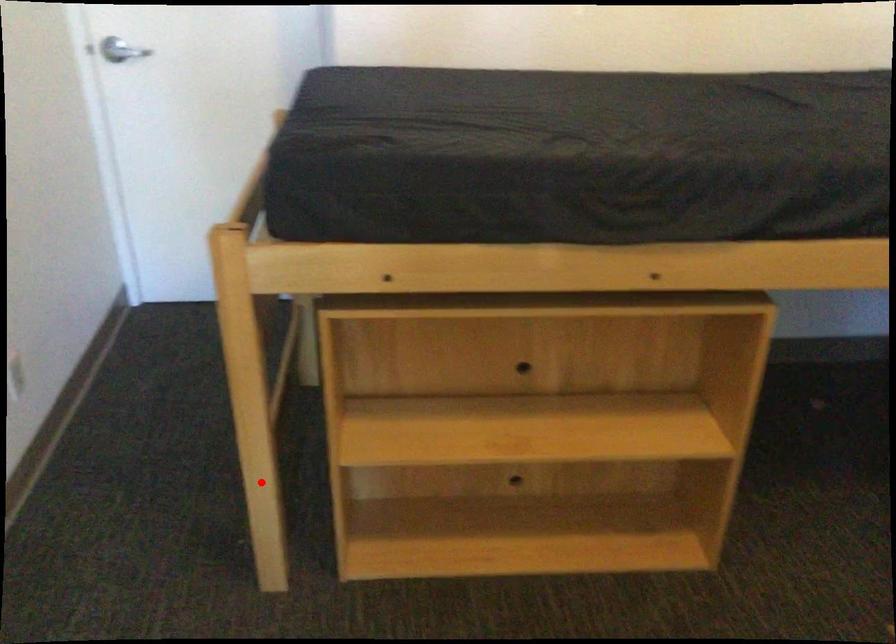
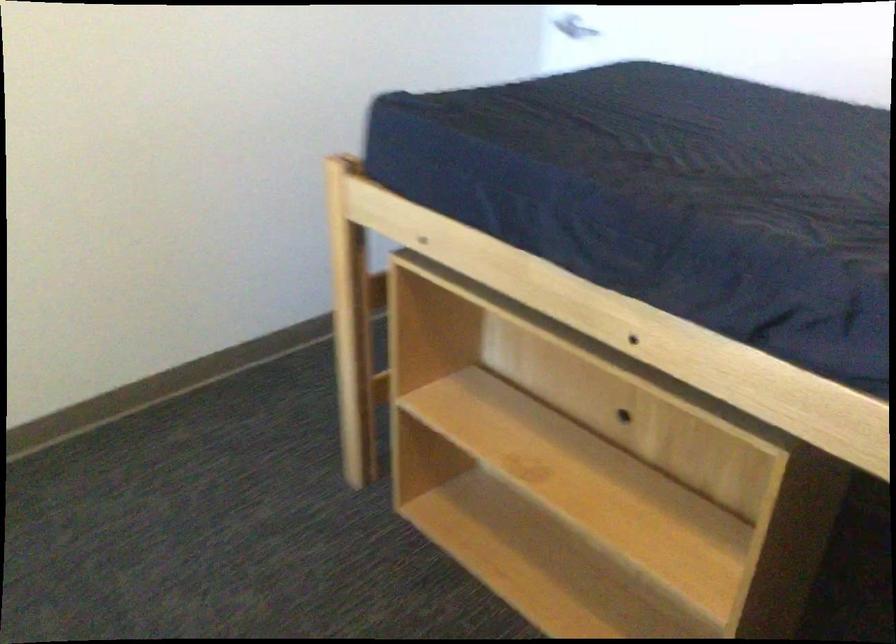
The point at the highlighted location is marked in the first image. Where is the corresponding point in the second image?

(377, 397)